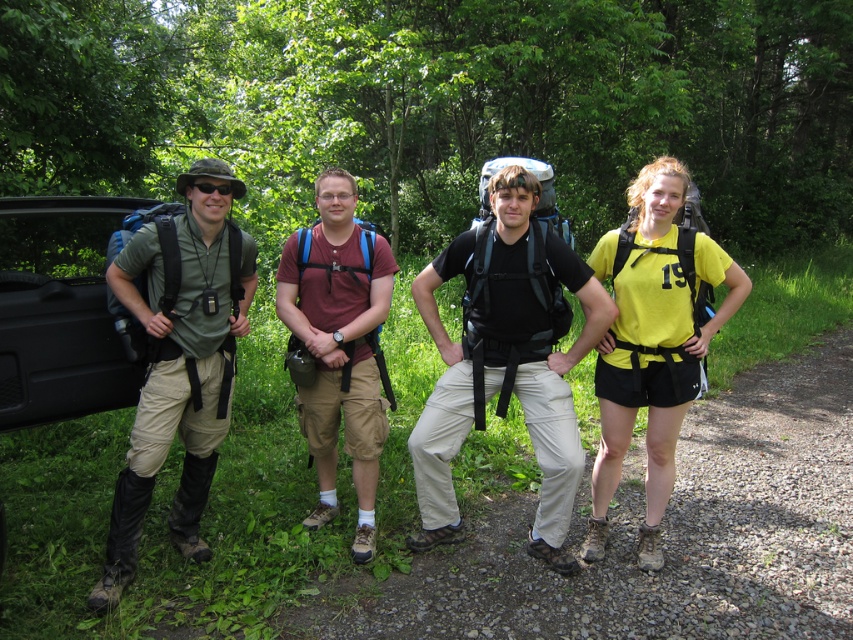
Question: Estimate the real-world distances between objects in this image. Which object is closer to the matte red shirt at center?

Choices:
 (A) matte black backpack at center
 (B) yellow matte shirt at right
 (C) green matte shirt at left

Answer: (A)

Question: Which point is farther to the camera?

Choices:
 (A) (703, 339)
 (B) (396, 269)
 (C) (132, 314)
 (D) (424, 531)

Answer: (B)

Question: Which of the following is the farthest from the observer?

Choices:
 (A) green matte shirt at left
 (B) yellow matte shirt at right

Answer: (B)

Question: Can you confirm if yellow matte shirt at right is positioned above matte red shirt at center?

Choices:
 (A) no
 (B) yes

Answer: (A)

Question: Is matte black backpack at center above matte red shirt at center?

Choices:
 (A) yes
 (B) no

Answer: (B)

Question: From the image, what is the correct spatial relationship of green leafy forest at upper center in relation to matte red shirt at center?

Choices:
 (A) left
 (B) right

Answer: (B)